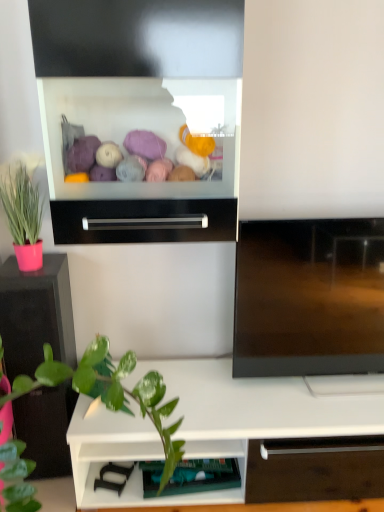
What do you see at coordinates (203, 476) in the screenshot? Image resolution: width=384 pixels, height=512 pixels. I see `teal fabric drawer at lower center, the second shelf in the right-to-left sequence` at bounding box center [203, 476].

What do you see at coordinates (23, 217) in the screenshot?
I see `pink matte pot at left` at bounding box center [23, 217].

Measure the distance between pink matte pot at left and camera.

A distance of 1.45 meters exists between pink matte pot at left and camera.

You are a GUI agent. You are given a task and a screenshot of the screen. Output one action in this format:
    pyautogui.click(x=<x>, y=<y>)
    Task: Click on the black metallic drawer at center
    
    Given the screenshot: What is the action you would take?
    pyautogui.click(x=143, y=221)

How different are the orientations of black metallic drawer at center and black glossy tv cabinet at left in degrees?

5.37 degrees.

From a real-world perspective, between black metallic drawer at center and black glossy tv cabinet at left, who is vertically higher?

From a 3D spatial view, black metallic drawer at center is above.

Is black metallic drawer at center oriented towards black glossy tv cabinet at left?

No, black metallic drawer at center is not aimed at black glossy tv cabinet at left.

From a real-world perspective, is black metallic drawer at center positioned under pink matte pot at left based on gravity?

Indeed, from a real-world perspective, black metallic drawer at center is positioned beneath pink matte pot at left.

Is black metallic drawer at center facing away from pink matte pot at left?

That's not correct — black metallic drawer at center is not looking away from pink matte pot at left.

Which is correct: black metallic drawer at center is inside pink matte pot at left, or outside of it?

black metallic drawer at center exists outside the volume of pink matte pot at left.

Looking at this image, considering the sizes of objects black metallic drawer at center and pink matte pot at left in the image provided, who is smaller, black metallic drawer at center or pink matte pot at left?

With smaller size is black metallic drawer at center.

Is pink matte pot at left not within black glossy tv cabinet at left?

pink matte pot at left is positioned outside black glossy tv cabinet at left.

Is point (29, 195) closer to camera compared to point (52, 426)?

Yes, point (29, 195) is closer to viewer.

From a real-world perspective, which is physically below, pink matte pot at left or black glossy tv cabinet at left?

black glossy tv cabinet at left, from a real-world perspective.

Does pink matte pot at left come behind white matte shelf at lower center, the 1th shelf viewed from the right?

No, pink matte pot at left is in front of white matte shelf at lower center, the 1th shelf viewed from the right.

From the image's perspective, is pink matte pot at left above or below white matte shelf at lower center, the 1th shelf viewed from the right?

Based on their image positions, pink matte pot at left is located above white matte shelf at lower center, the 1th shelf viewed from the right.

Does point (21, 167) lie behind point (255, 444)?

Yes, point (21, 167) is farther from viewer.

Is pink matte pot at left positioned with its back to white matte shelf at lower center, the 1th shelf viewed from the right?

No, white matte shelf at lower center, the 1th shelf viewed from the right, is not at the back of pink matte pot at left.

Is point (217, 199) farther from viewer compared to point (151, 470)?

That is False.

Based on their positions, is black metallic drawer at center located to the left or right of teal fabric drawer at lower center, the second shelf in the right-to-left sequence?

black metallic drawer at center is to the left of teal fabric drawer at lower center, the second shelf in the right-to-left sequence.

How different are the orientations of black metallic drawer at center and teal fabric drawer at lower center, the second shelf in the right-to-left sequence, in degrees?

The facing directions of black metallic drawer at center and teal fabric drawer at lower center, the second shelf in the right-to-left sequence, are 6.16 degrees apart.

Which of these two, black metallic drawer at center or teal fabric drawer at lower center, which is counted as the 1th shelf, starting from the left, is wider?

With larger width is black metallic drawer at center.

Is pink matte pot at left facing towards black metallic drawer at center?

No, pink matte pot at left does not turn towards black metallic drawer at center.

Considering the relative positions of pink matte pot at left and black metallic drawer at center in the image provided, is pink matte pot at left to the left or to the right of black metallic drawer at center?

From the image, it's evident that pink matte pot at left is to the left of black metallic drawer at center.

In order to click on drawer below the pink matte pot at left (from the image's perspective) in this screenshot , I will do `click(143, 221)`.

From the image's perspective, which one is positioned higher, pink matte pot at left or black metallic drawer at center?

pink matte pot at left is shown above in the image.

Considering the positions of objects teal fabric drawer at lower center, which is counted as the 1th shelf, starting from the left, and white matte shelf at lower center, the 1th shelf viewed from the right, in the image provided, who is more to the left, teal fabric drawer at lower center, which is counted as the 1th shelf, starting from the left, or white matte shelf at lower center, the 1th shelf viewed from the right,?

teal fabric drawer at lower center, which is counted as the 1th shelf, starting from the left, is more to the left.

Image resolution: width=384 pixels, height=512 pixels. I want to click on shelf above the white matte shelf at lower center, which appears as the second shelf when viewed from the left (from the image's perspective), so point(203,476).

Identify the location of drawer that is above the black glossy tv cabinet at left (from the image's perspective). (143, 221).

Where is `drawer that is below the pink matte pot at left (from the image's perspective)`? The image size is (384, 512). drawer that is below the pink matte pot at left (from the image's perspective) is located at coordinates (143, 221).

Which object lies nearer to the anchor point black metallic drawer at center, black glossy tv cabinet at left or pink matte pot at left?

Based on the image, pink matte pot at left appears to be nearer to black metallic drawer at center.

Looking at the image, which one is located closer to pink matte pot at left, black metallic drawer at center or teal fabric drawer at lower center, which is counted as the 1th shelf, starting from the left?

black metallic drawer at center lies closer to pink matte pot at left than the other object.

When comparing their distances from black metallic drawer at center, does pink matte pot at left or white matte shelf at lower center, which appears as the second shelf when viewed from the left, seem closer?

Based on the image, pink matte pot at left appears to be nearer to black metallic drawer at center.

From the image, which object appears to be nearer to teal fabric drawer at lower center, the second shelf in the right-to-left sequence, black metallic drawer at center or pink matte pot at left?

black metallic drawer at center lies closer to teal fabric drawer at lower center, the second shelf in the right-to-left sequence, than the other object.

From the image, which object appears to be farther from black metallic drawer at center, pink matte pot at left or teal fabric drawer at lower center, the second shelf in the right-to-left sequence?

teal fabric drawer at lower center, the second shelf in the right-to-left sequence, lies further to black metallic drawer at center than the other object.

Based on their spatial positions, is black metallic drawer at center or black glossy tv cabinet at left closer to pink matte pot at left?

The object closer to pink matte pot at left is black glossy tv cabinet at left.

Considering their positions, is pink matte pot at left positioned further to black glossy tv cabinet at left than teal fabric drawer at lower center, which is counted as the 1th shelf, starting from the left?

teal fabric drawer at lower center, which is counted as the 1th shelf, starting from the left, is positioned further to the anchor black glossy tv cabinet at left.

Estimate the real-world distances between objects in this image. Which object is closer to black glossy tv cabinet at left, black metallic drawer at center or teal fabric drawer at lower center, the second shelf in the right-to-left sequence?

black metallic drawer at center is closer to black glossy tv cabinet at left.

Where is `shelf between black metallic drawer at center and white matte shelf at lower center, which appears as the second shelf when viewed from the left, vertically`? Image resolution: width=384 pixels, height=512 pixels. shelf between black metallic drawer at center and white matte shelf at lower center, which appears as the second shelf when viewed from the left, vertically is located at coordinates (203, 476).

Identify the location of drawer between pink matte pot at left and white matte shelf at lower center, which appears as the second shelf when viewed from the left, in the vertical direction. (143, 221).

Where is `tv cabinet between black metallic drawer at center and white matte shelf at lower center, the 1th shelf viewed from the right, from top to bottom`? This screenshot has width=384, height=512. tv cabinet between black metallic drawer at center and white matte shelf at lower center, the 1th shelf viewed from the right, from top to bottom is located at coordinates 36,315.

At what (x,y) coordinates should I click in order to perform the action: click on tv cabinet between black metallic drawer at center and teal fabric drawer at lower center, which is counted as the 1th shelf, starting from the left, from top to bottom. Please return your answer as a coordinate pair (x, y). Looking at the image, I should click on (36, 315).